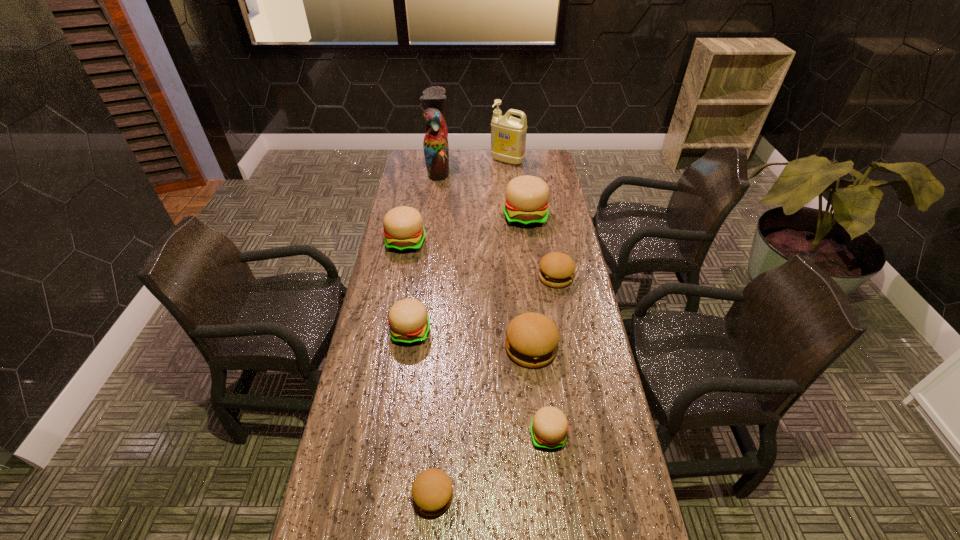
Identify the location of vacant region located on the front of the biggest brown hamburger. The image size is (960, 540). (536, 394).

At what (x,y) coordinates should I click in order to perform the action: click on vacant region located on the left of the fifth nearest object. Please return your answer as a coordinate pair (x, y). Looking at the image, I should click on pos(431,277).

This screenshot has height=540, width=960. Identify the location of blank space located 0.080m on the back of the smallest beige hamburger. (543, 393).

The height and width of the screenshot is (540, 960). What are the coordinates of `free spot located 0.400m on the right of the shortest object` in the screenshot? It's located at (618, 496).

Identify the location of parrot present at the far edge. (436, 149).

I want to click on detergent located at the far edge, so click(508, 134).

Find the location of a particular element. This screenshot has width=960, height=540. parrot located in the left edge section of the desktop is located at coordinates (436, 149).

Find the location of a particular element. The height and width of the screenshot is (540, 960). detergent that is positioned at the right edge is located at coordinates [x=508, y=134].

Identify the location of object that is at the far left corner. (436, 149).

Find the location of a particular element. The image size is (960, 540). object that is at the far right corner is located at coordinates (508, 134).